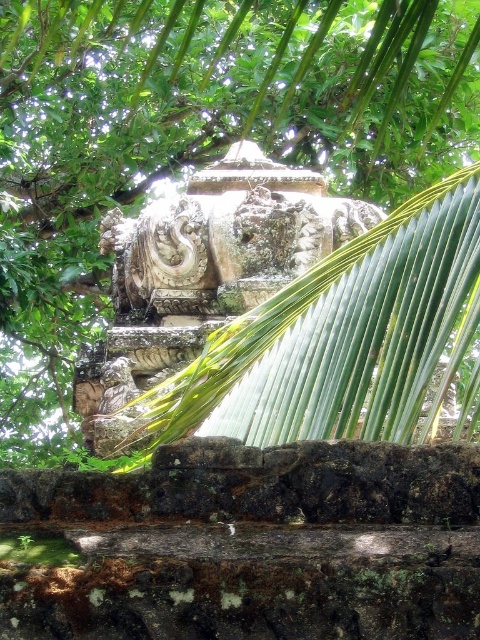
Question: Does green leafy tree at upper center have a lesser width compared to carved stone sculpture at center?

Choices:
 (A) no
 (B) yes

Answer: (A)

Question: Can you confirm if green leafy tree at upper center is smaller than carved stone sculpture at center?

Choices:
 (A) no
 (B) yes

Answer: (A)

Question: Is green leafy tree at upper center thinner than carved stone sculpture at center?

Choices:
 (A) no
 (B) yes

Answer: (A)

Question: Which point is closer to the camera taking this photo?

Choices:
 (A) (147, 208)
 (B) (204, 93)

Answer: (A)